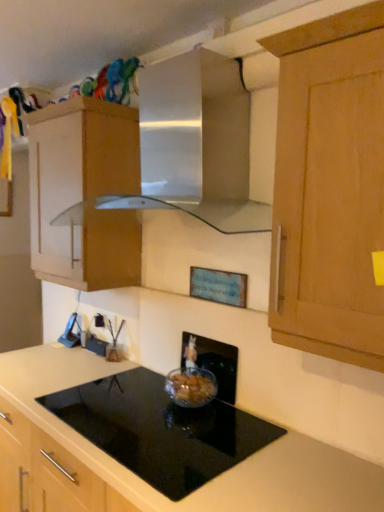
Question: Is clear glass bowl at center smaller than black plastic electric outlet at lower left?

Choices:
 (A) yes
 (B) no

Answer: (B)

Question: Does clear glass bowl at center come in front of black plastic electric outlet at lower left?

Choices:
 (A) yes
 (B) no

Answer: (A)

Question: Are clear glass bowl at center and black plastic electric outlet at lower left making contact?

Choices:
 (A) no
 (B) yes

Answer: (A)

Question: Is clear glass bowl at center looking in the opposite direction of black plastic electric outlet at lower left?

Choices:
 (A) no
 (B) yes

Answer: (A)

Question: From the image's perspective, would you say clear glass bowl at center is shown under black plastic electric outlet at lower left?

Choices:
 (A) yes
 (B) no

Answer: (A)

Question: From the image's perspective, relative to black plastic electric outlet at lower left, is black glass cooktop at center above or below?

Choices:
 (A) below
 (B) above

Answer: (A)

Question: Is black glass cooktop at center in front of or behind black plastic electric outlet at lower left in the image?

Choices:
 (A) behind
 (B) front

Answer: (B)

Question: Is black glass cooktop at center situated inside black plastic electric outlet at lower left or outside?

Choices:
 (A) outside
 (B) inside

Answer: (A)

Question: From a real-world perspective, is black glass cooktop at center above or below black plastic electric outlet at lower left?

Choices:
 (A) below
 (B) above

Answer: (A)

Question: In the image, is black glass cooktop at center positioned in front of or behind clear glass bowl at center?

Choices:
 (A) behind
 (B) front

Answer: (B)

Question: Considering the relative positions of black glass cooktop at center and clear glass bowl at center in the image provided, is black glass cooktop at center to the left or to the right of clear glass bowl at center?

Choices:
 (A) right
 (B) left

Answer: (B)

Question: Considering the positions of black glass cooktop at center and clear glass bowl at center in the image, is black glass cooktop at center wider or thinner than clear glass bowl at center?

Choices:
 (A) wide
 (B) thin

Answer: (A)

Question: From the image's perspective, is black glass cooktop at center positioned above or below clear glass bowl at center?

Choices:
 (A) above
 (B) below

Answer: (B)

Question: Visually, is satin silver vent at upper center positioned to the left or to the right of black plastic electric outlet at lower left?

Choices:
 (A) left
 (B) right

Answer: (B)

Question: Relative to black plastic electric outlet at lower left, is satin silver vent at upper center in front or behind?

Choices:
 (A) front
 (B) behind

Answer: (A)